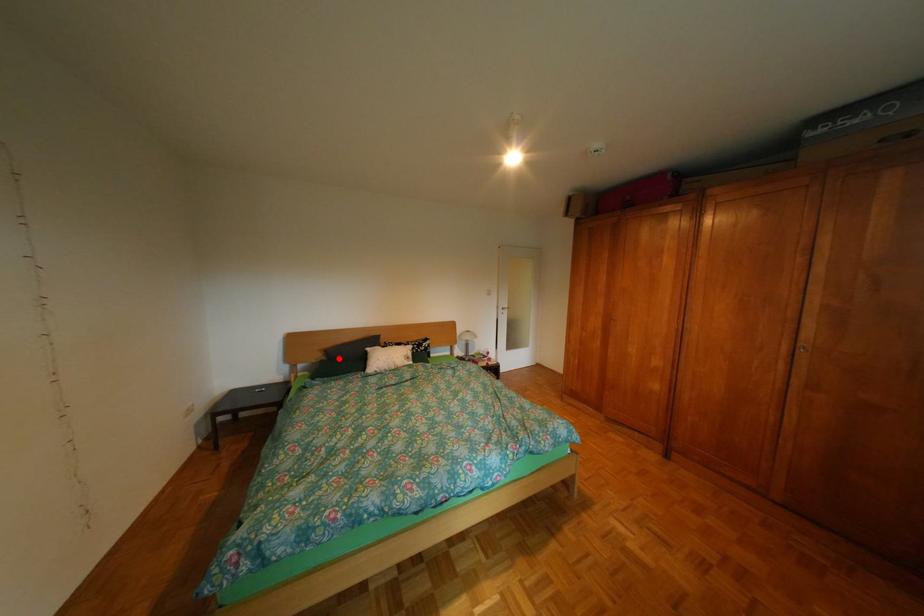
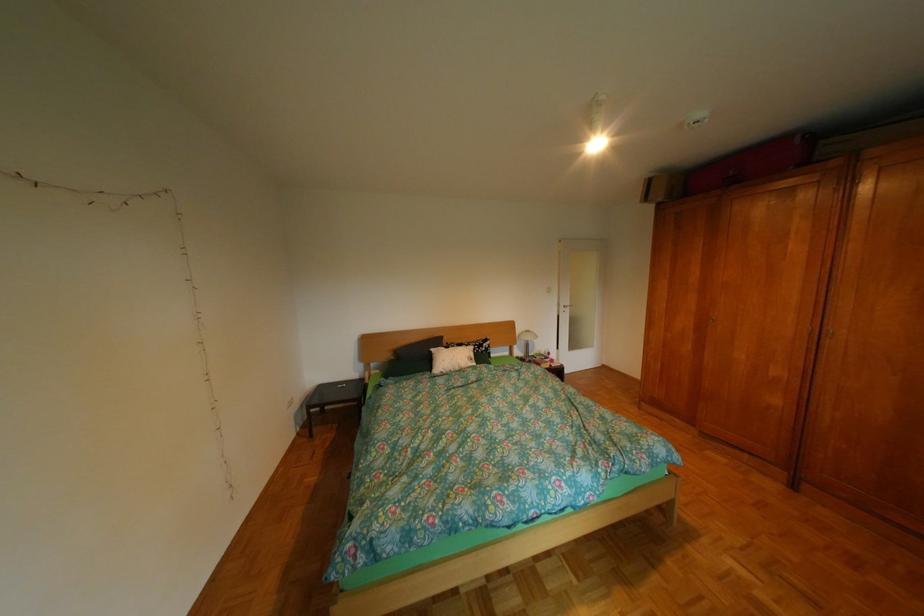
Where in the second image is the point corresponding to the highlighted location from the first image?

(407, 359)